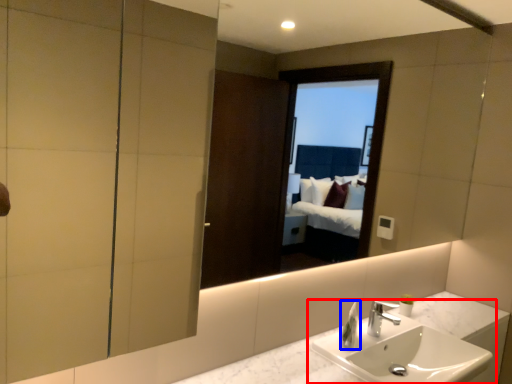
Question: Which object is further to the camera taking this photo, sink (highlighted by a red box) or soap dispenser (highlighted by a blue box)?

Choices:
 (A) sink
 (B) soap dispenser

Answer: (B)